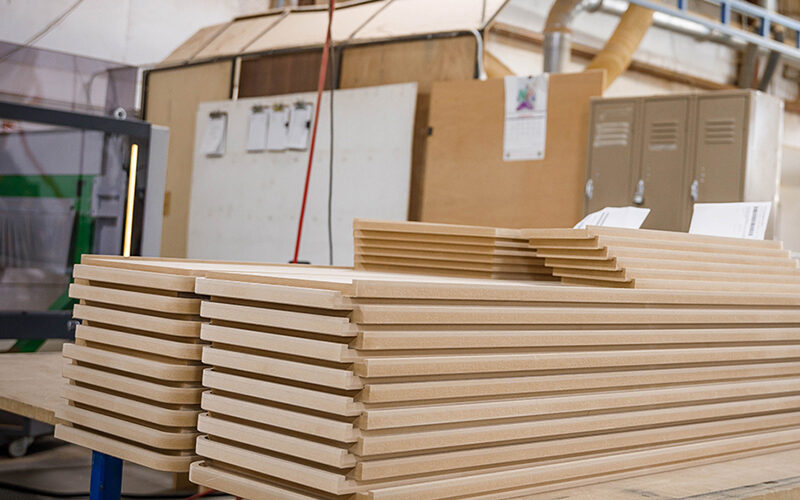
The width and height of the screenshot is (800, 500). Identify the location of more wood panels in the back. (449, 265), (452, 259), (477, 233), (580, 249), (608, 273), (596, 237).